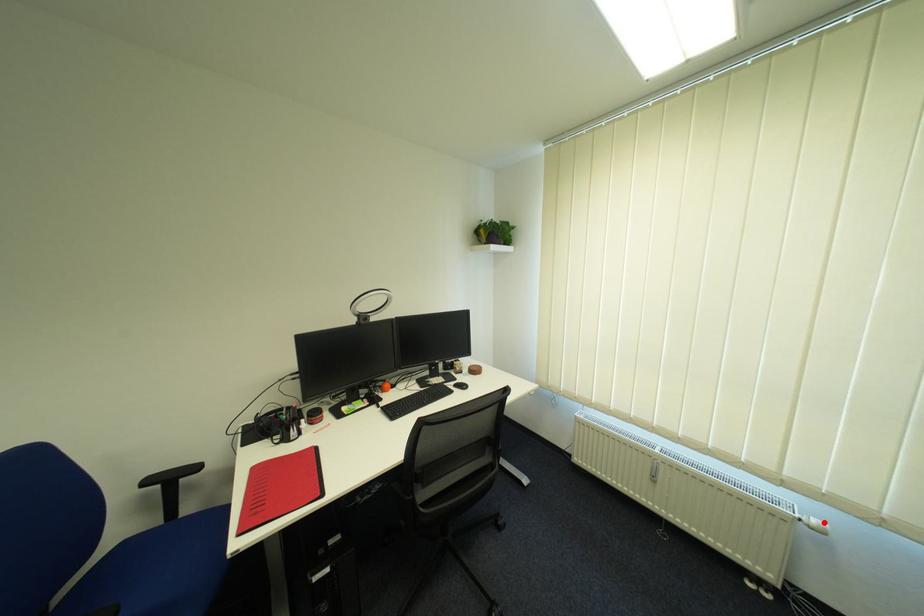
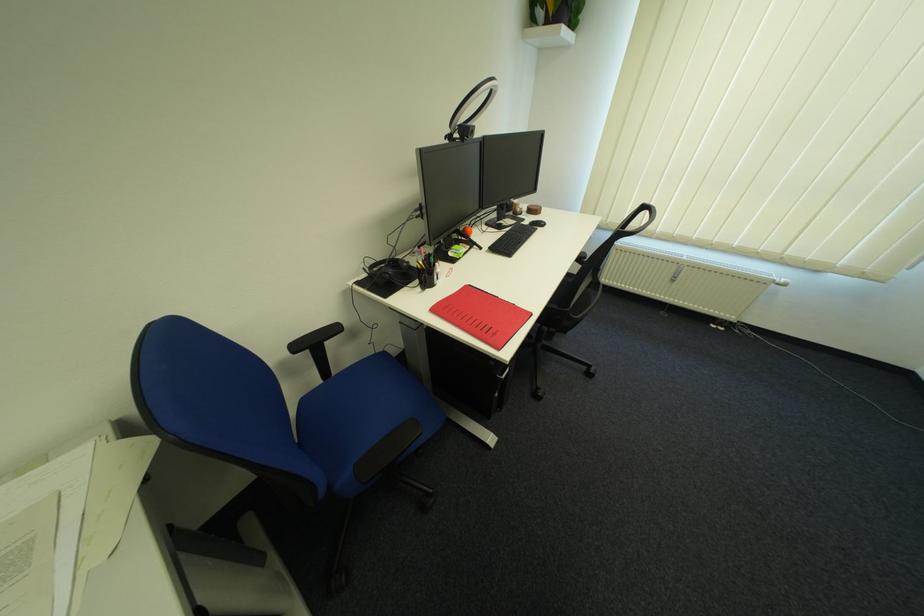
Locate, in the second image, the point that corresponds to the highlighted location in the first image.

(793, 281)